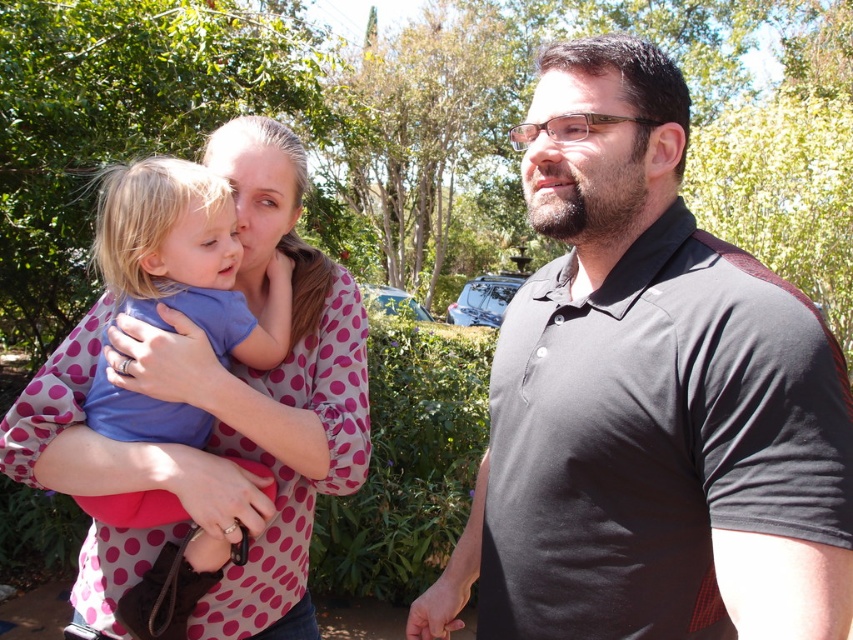
Question: Which of the following is the farthest from the observer?

Choices:
 (A) (158, 371)
 (B) (573, 92)

Answer: (A)

Question: Does black smooth polo shirt at right appear on the right side of pink polka dot blouse at upper left?

Choices:
 (A) no
 (B) yes

Answer: (B)

Question: Among these objects, which one is farthest from the camera?

Choices:
 (A) black smooth polo shirt at right
 (B) pink polka dot blouse at upper left

Answer: (B)

Question: Can you confirm if black smooth polo shirt at right is thinner than pink polka dot blouse at upper left?

Choices:
 (A) yes
 (B) no

Answer: (A)

Question: Is black smooth polo shirt at right smaller than pink polka dot blouse at upper left?

Choices:
 (A) no
 (B) yes

Answer: (A)